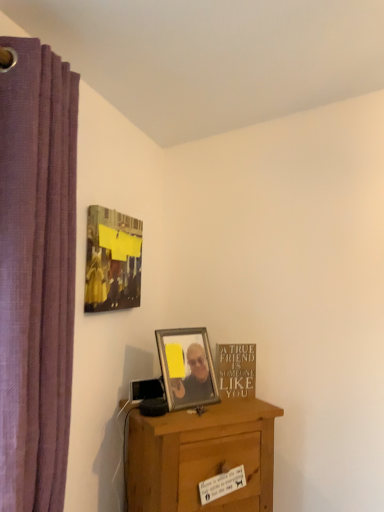
I want to click on spots to the right of metallic silver picture frame at center, acting as the 2th picture frame starting from the top, so click(229, 406).